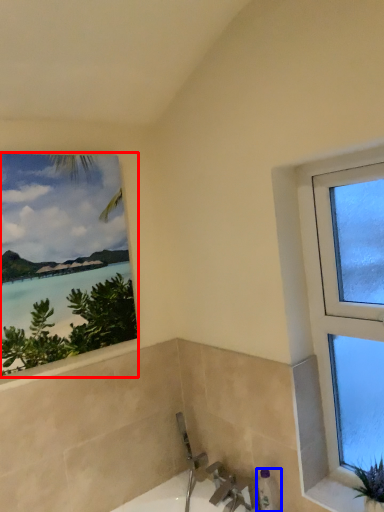
Question: Which point is further to the camera, window (highlighted by a red box) or toiletry (highlighted by a blue box)?

Choices:
 (A) window
 (B) toiletry

Answer: (B)